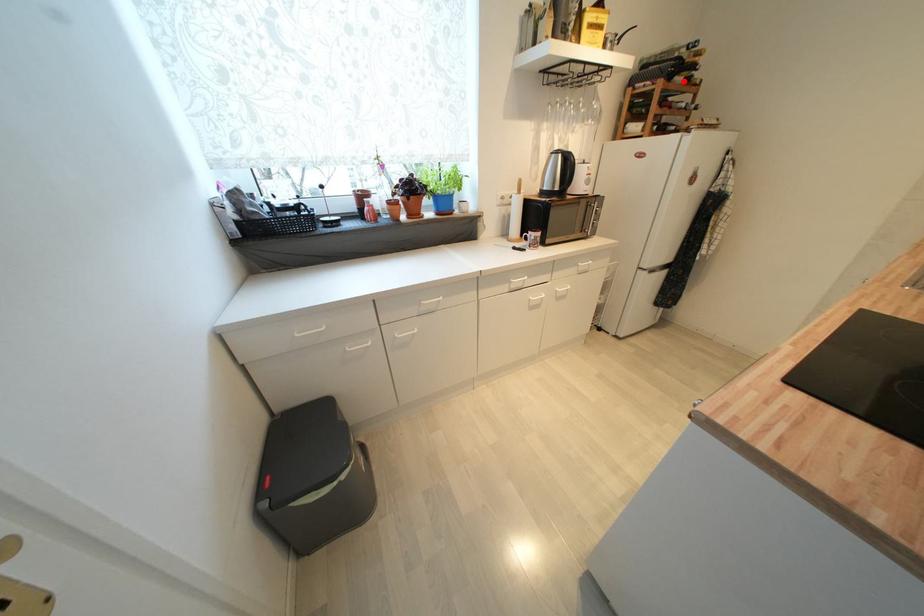
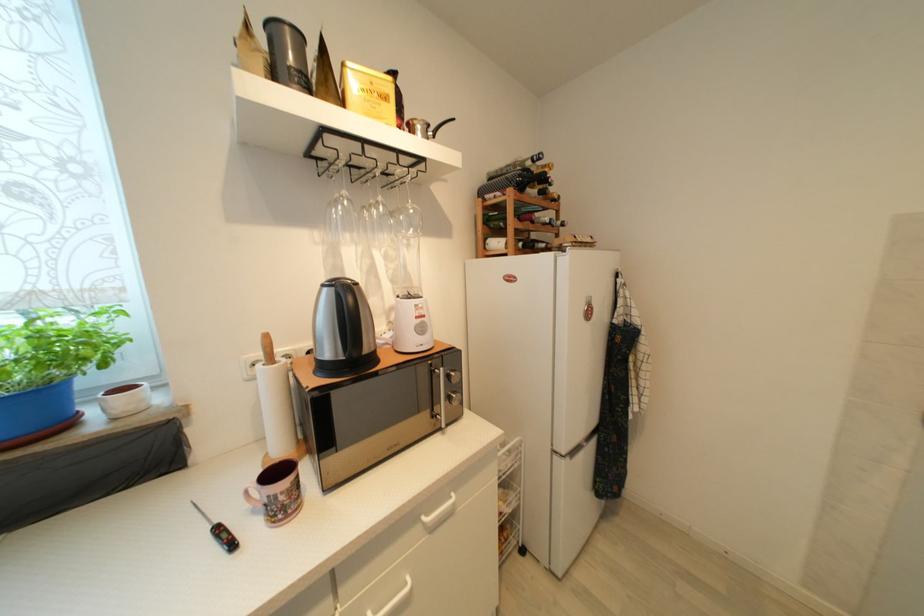
Locate, in the second image, the point that corresponds to the highlighted location in the first image.

(538, 193)